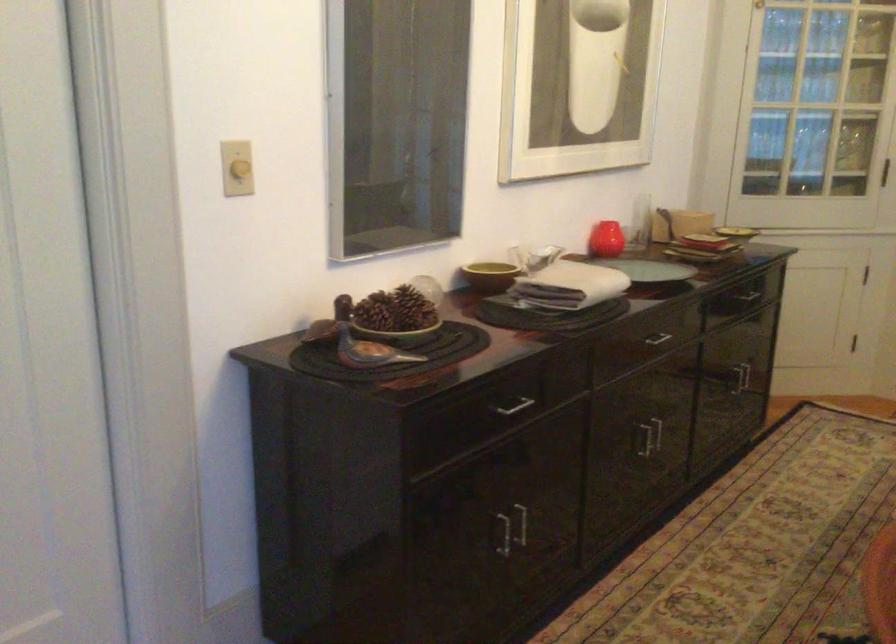
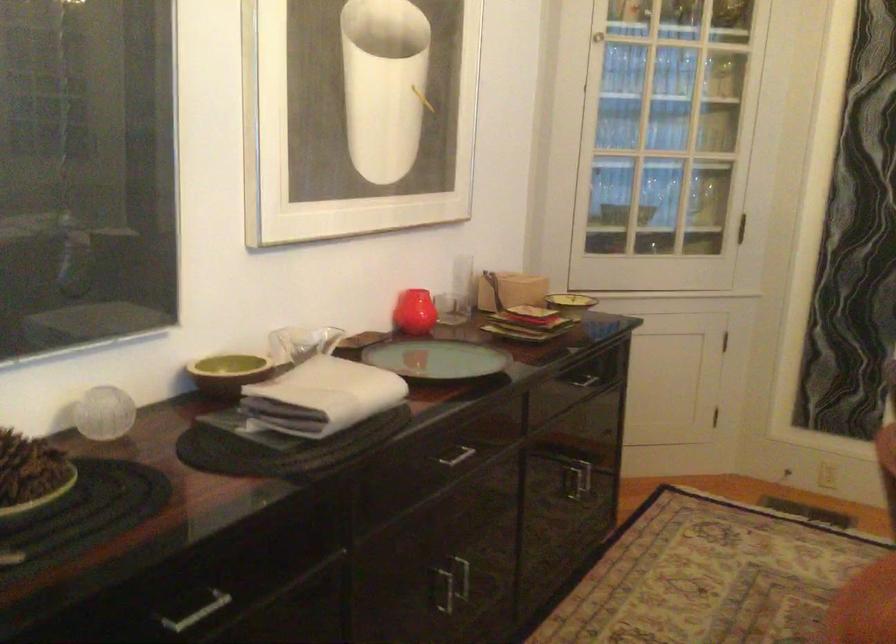
Find the pixel in the second image that matches point 505,408 in the first image.

(194, 609)